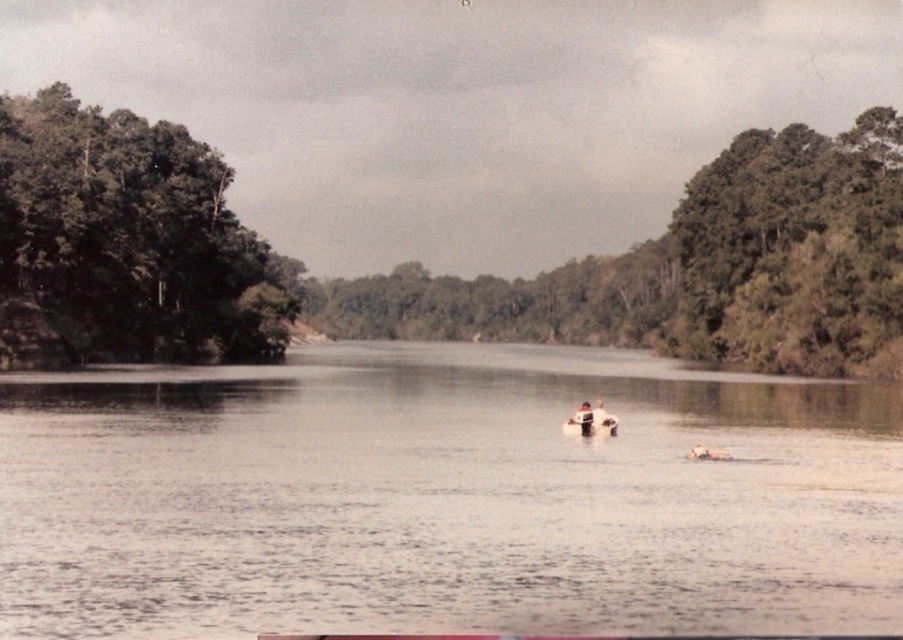
You are an environmental scientist assessing the riverbanks for a study. You observe the green leafy trees at left and the green leafy tree at right. Which group has a greater width, and what might this indicate about their environmental conditions?

The green leafy trees at left have a greater width than the green leafy tree at right. This could indicate that the trees on the left side of the riverbank have access to more resources like sunlight, water, or nutrients, leading to their broader growth compared to the tree on the right.

You are standing at point (706, 204) and want to cross the river to the other side. The river is 162.61 meters wide at this point. You have a 150 meter long rope. Can you safely cross the river using this rope?

The river is 162.61 meters wide at this point, which is wider than the 150 meter long rope you have. Therefore, you cannot safely cross the river using this rope.

You are standing on the riverbank and want to cross the river to the other side. The clear water at center is where the river is shallowest. Where should you aim to cross the river?

You should aim for the clear water at center since it is the shallowest part of the river.